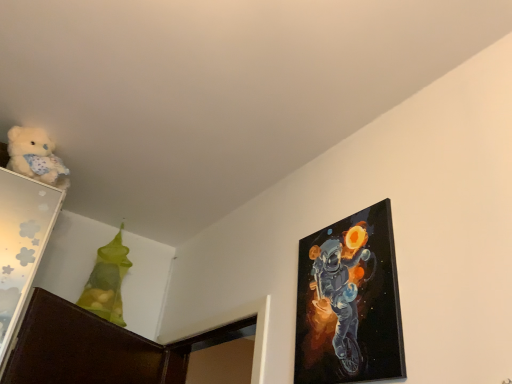
Question: Is point (41, 145) positioned closer to the camera than point (125, 253)?

Choices:
 (A) farther
 (B) closer

Answer: (B)

Question: From a real-world perspective, is fluffy white teddy bear at upper left positioned above or below translucent green bag at upper left?

Choices:
 (A) above
 (B) below

Answer: (A)

Question: Estimate the real-world distances between objects in this image. Which object is farther from the translucent green bag at upper left?

Choices:
 (A) fluffy white teddy bear at upper left
 (B) glossy canvas painting at upper right

Answer: (B)

Question: Which object is positioned farthest from the fluffy white teddy bear at upper left?

Choices:
 (A) translucent green bag at upper left
 (B) glossy canvas painting at upper right

Answer: (B)